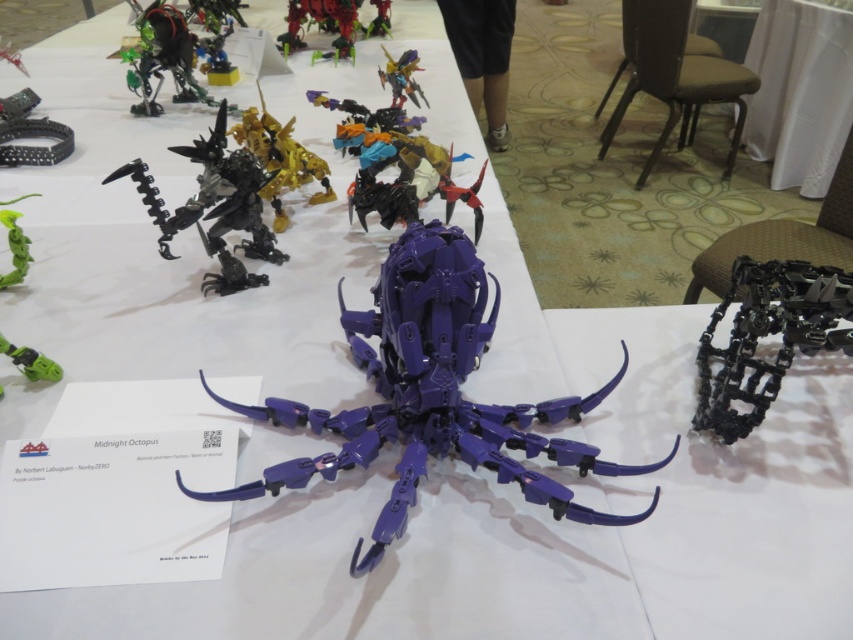
Question: In this image, where is black metallic chain at center located relative to brushed metal dragonfly at upper center?

Choices:
 (A) left
 (B) right

Answer: (B)

Question: Based on their relative distances, which object is nearer to the black metallic chain at upper left?

Choices:
 (A) green matte plant at upper left
 (B) green matte claw at lower left

Answer: (A)

Question: Is black metallic chain at upper left wider than metallic green robot at upper center?

Choices:
 (A) yes
 (B) no

Answer: (B)

Question: Which object is positioned farthest from the metallic green robot at upper center?

Choices:
 (A) shiny black robot at upper left
 (B) black matte scorpion at upper left
 (C) purple plastic octopus at center
 (D) metallic blue robot at upper center

Answer: (C)

Question: Which point is closer to the camera?

Choices:
 (A) black metallic chain at center
 (B) black matte scorpion at upper left
 (C) purple plastic octopus at center

Answer: (C)

Question: Does black metallic chain at upper left have a smaller size compared to green matte claw at lower left?

Choices:
 (A) no
 (B) yes

Answer: (A)